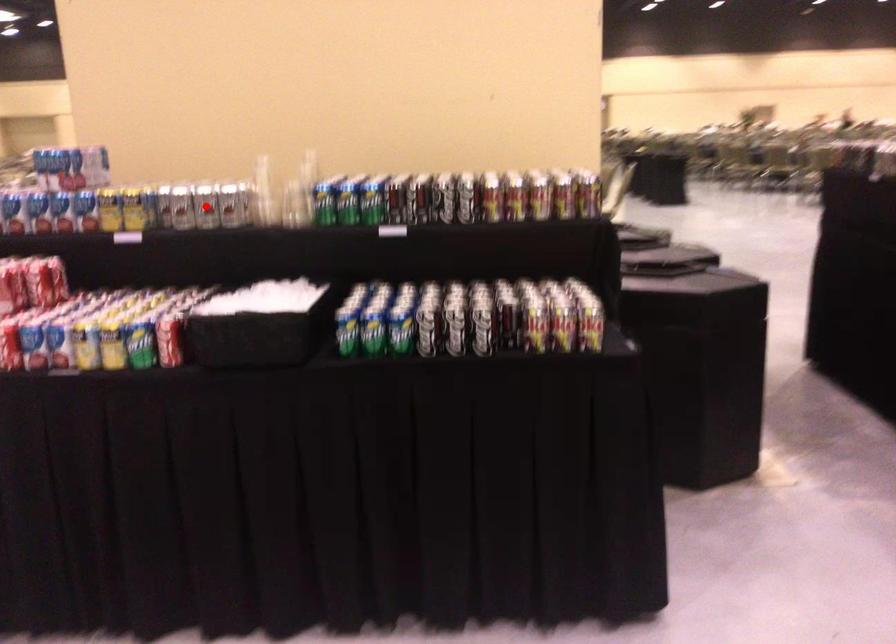
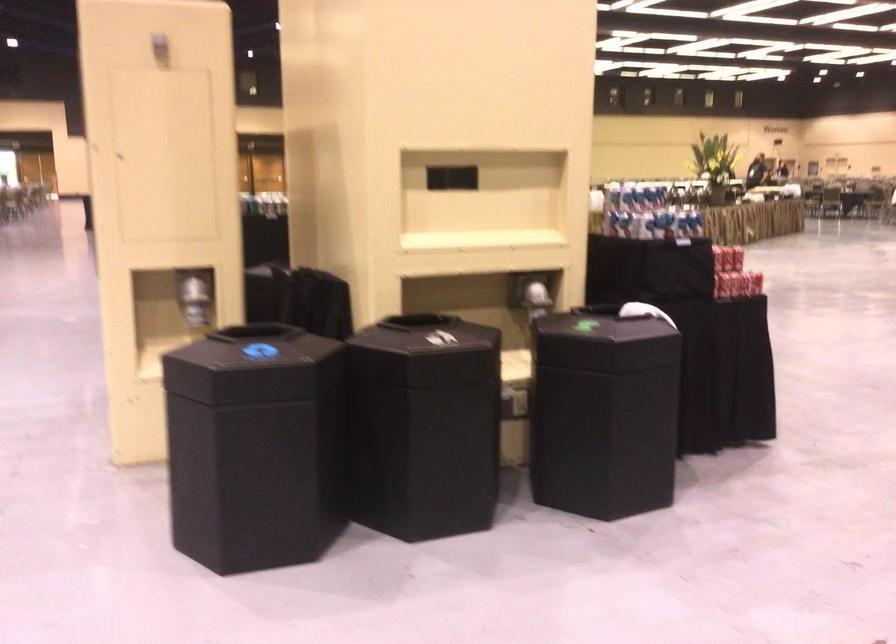
Question: I am providing you with two images of the same scene from different viewpoints. A red point is marked on the first image. Is the red point's position out of view in image 2?

Choices:
 (A) Yes
 (B) No

Answer: (A)